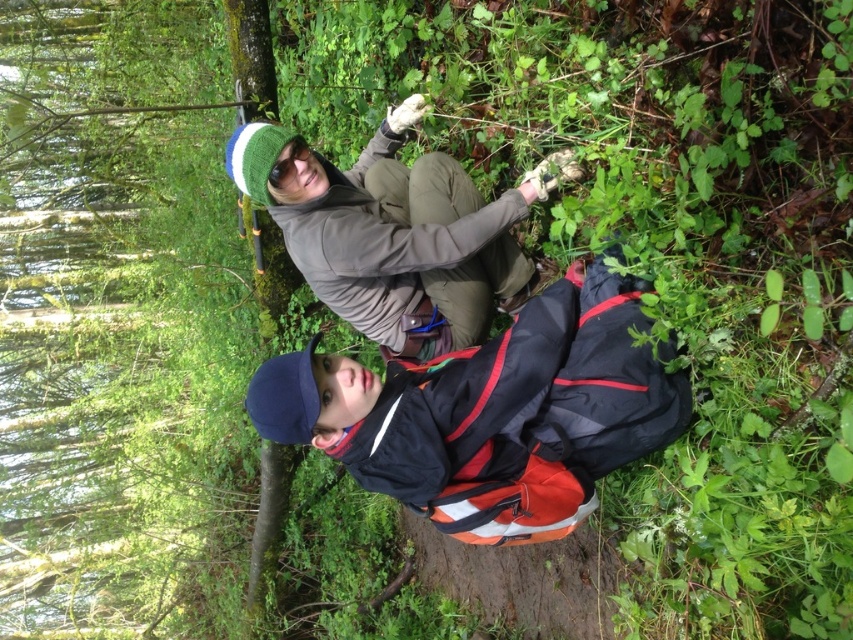
You are planning to take a photo of both the reflective blue jacket at lower center and the matte gray jacket at upper center. Which jacket has a larger width when viewed from your current position?

The reflective blue jacket at lower center has a larger width than the matte gray jacket at upper center.

You are a hiker trying to determine which jacket is closer to you based on their sizes. The reflective blue jacket at lower center and the matte gray jacket at upper center are visible. Which one is closer?

The reflective blue jacket at lower center is smaller than the matte gray jacket at upper center, so the smaller jacket is closer to you.